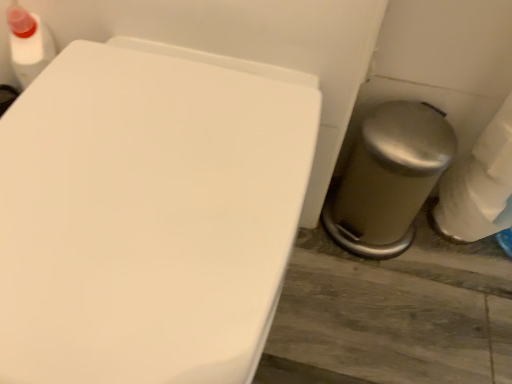
Question: Is satin silver trash can at lower right thinner than white glossy toilet at center?

Choices:
 (A) no
 (B) yes

Answer: (B)

Question: Is white glossy toilet at center a part of satin silver trash can at lower right?

Choices:
 (A) no
 (B) yes

Answer: (A)

Question: Is satin silver trash can at lower right looking in the opposite direction of white glossy toilet at center?

Choices:
 (A) no
 (B) yes

Answer: (A)

Question: Is satin silver trash can at lower right to the right of white glossy toilet at center from the viewer's perspective?

Choices:
 (A) no
 (B) yes

Answer: (B)

Question: Does satin silver trash can at lower right have a larger size compared to white glossy toilet at center?

Choices:
 (A) yes
 (B) no

Answer: (B)

Question: Are satin silver trash can at lower right and white glossy toilet at center beside each other?

Choices:
 (A) yes
 (B) no

Answer: (B)

Question: Considering the relative sizes of white glossy toilet at center and satin silver trash can at lower right in the image provided, is white glossy toilet at center thinner than satin silver trash can at lower right?

Choices:
 (A) no
 (B) yes

Answer: (A)

Question: Can you confirm if white glossy toilet at center is wider than satin silver trash can at lower right?

Choices:
 (A) no
 (B) yes

Answer: (B)

Question: Considering the relative sizes of white glossy toilet at center and satin silver trash can at lower right in the image provided, is white glossy toilet at center taller than satin silver trash can at lower right?

Choices:
 (A) yes
 (B) no

Answer: (A)

Question: Considering the relative positions of white glossy toilet at center and satin silver trash can at lower right in the image provided, is white glossy toilet at center to the right of satin silver trash can at lower right from the viewer's perspective?

Choices:
 (A) yes
 (B) no

Answer: (B)

Question: Is white glossy toilet at center positioned far away from satin silver trash can at lower right?

Choices:
 (A) no
 (B) yes

Answer: (A)

Question: From the image's perspective, is white glossy toilet at center under satin silver trash can at lower right?

Choices:
 (A) no
 (B) yes

Answer: (B)

Question: Considering the positions of point (202, 339) and point (420, 182), is point (202, 339) closer or farther from the camera than point (420, 182)?

Choices:
 (A) farther
 (B) closer

Answer: (B)